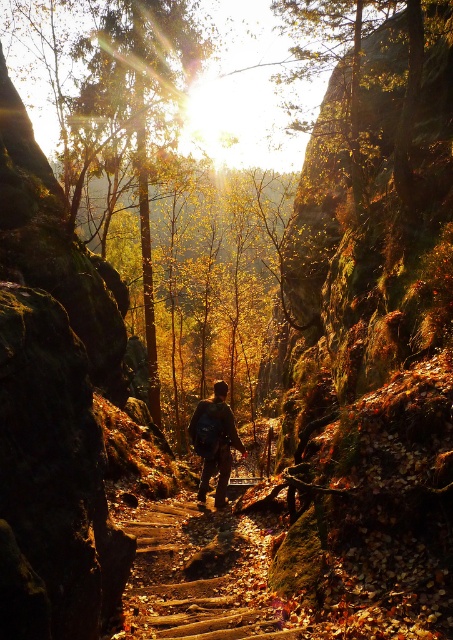
You are a hiker trying to navigate the narrow path. The green mossy rock at center and the brown wooden trail at center are both in your way. Which one should you avoid stepping on to stay on the trail?

You should avoid stepping on the green mossy rock at center because it is larger than the brown wooden trail at center, making it more likely to obstruct your path.